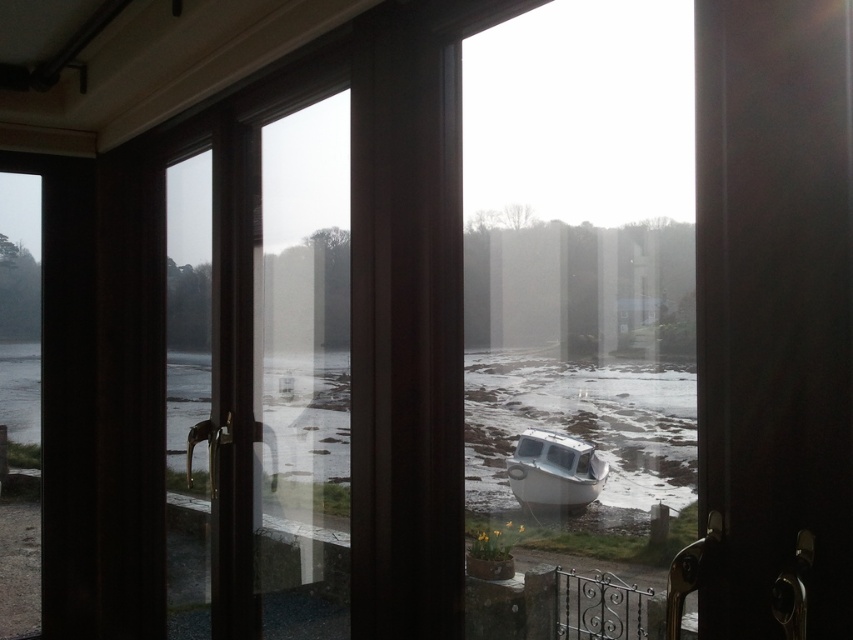
You are standing inside the house looking through the glass doors. You notice the clear water at lower center and the white matte boat at center. Which one is wider in the image?

The clear water at lower center is wider than the white matte boat at center in the image.

You are standing inside the house looking through the glass doors. There are two points marked on the glass doors. The first point is at coordinates point (x=840, y=364) and the second point is at point (x=624, y=387). Which point is closer to you?

Point (x=840, y=364) is in front of point (x=624, y=387), so the first point is closer to you.

You are a delivery robot with a height of 1.2 meters. You are standing inside the house near the dark wood screen door at center. You need to exit through the door to reach the clear water at lower center. Can you safely pass through the door without hitting your head?

The distance between the dark wood screen door at center and clear water at lower center is 1.15 meters. Since the robot is 1.2 meters tall, it is slightly taller than the available space. The robot may hit its head when passing through the door.